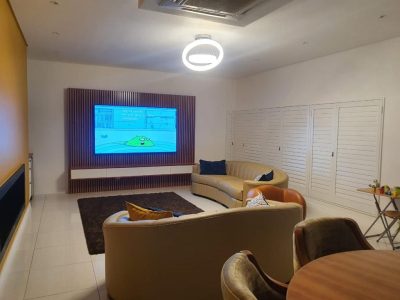
Where is `couch`? This screenshot has width=400, height=300. couch is located at coordinates (166, 248).